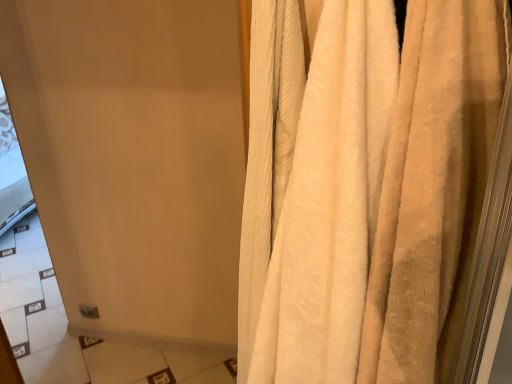
What do you see at coordinates (432, 191) in the screenshot? The image size is (512, 384). I see `beige textured curtain at right` at bounding box center [432, 191].

This screenshot has height=384, width=512. I want to click on beige textured curtain at right, so click(432, 191).

I want to click on matte white screen door at upper left, so click(x=134, y=157).

This screenshot has height=384, width=512. What do you see at coordinates (134, 157) in the screenshot? I see `matte white screen door at upper left` at bounding box center [134, 157].

Locate an element on the screen. The height and width of the screenshot is (384, 512). beige textured curtain at right is located at coordinates (432, 191).

Is matte white screen door at upper left to the left of beige textured curtain at right from the viewer's perspective?

Yes.

Considering the positions of objects matte white screen door at upper left and beige textured curtain at right in the image provided, who is in front, matte white screen door at upper left or beige textured curtain at right?

Positioned in front is beige textured curtain at right.

Is point (231, 298) positioned in front of point (384, 242)?

No, it is behind (384, 242).

From the image's perspective, does matte white screen door at upper left appear higher than beige textured curtain at right?

No, from the image's perspective, matte white screen door at upper left is not on top of beige textured curtain at right.

From a real-world perspective, between matte white screen door at upper left and beige textured curtain at right, who is vertically higher?

beige textured curtain at right.

Which object is wider, matte white screen door at upper left or beige textured curtain at right?

With larger width is beige textured curtain at right.

Who is taller, matte white screen door at upper left or beige textured curtain at right?

Standing taller between the two is matte white screen door at upper left.

Considering the relative sizes of matte white screen door at upper left and beige textured curtain at right in the image provided, is matte white screen door at upper left smaller than beige textured curtain at right?

Incorrect, matte white screen door at upper left is not smaller in size than beige textured curtain at right.

Choose the correct answer: Is matte white screen door at upper left inside beige textured curtain at right or outside it?

matte white screen door at upper left exists outside the volume of beige textured curtain at right.

Is matte white screen door at upper left next to beige textured curtain at right and touching it?

No.

Is beige textured curtain at right at the back of matte white screen door at upper left?

No.

How different are the orientations of matte white screen door at upper left and beige textured curtain at right in degrees?

The facing directions of matte white screen door at upper left and beige textured curtain at right are 4.56 degrees apart.

Identify the location of screen door that appears below the beige textured curtain at right (from the image's perspective). This screenshot has width=512, height=384. (134, 157).

Is beige textured curtain at right to the right of matte white screen door at upper left from the viewer's perspective?

Correct, you'll find beige textured curtain at right to the right of matte white screen door at upper left.

Considering the relative positions of beige textured curtain at right and matte white screen door at upper left in the image provided, is beige textured curtain at right behind matte white screen door at upper left?

No, it is in front of matte white screen door at upper left.

Is point (390, 330) farther from viewer compared to point (58, 12)?

No, (390, 330) is closer to viewer.

From the image's perspective, which one is positioned higher, beige textured curtain at right or matte white screen door at upper left?

beige textured curtain at right, from the image's perspective.

From a real-world perspective, which is physically below, beige textured curtain at right or matte white screen door at upper left?

From a 3D spatial view, matte white screen door at upper left is below.

Considering the sizes of objects beige textured curtain at right and matte white screen door at upper left in the image provided, who is wider, beige textured curtain at right or matte white screen door at upper left?

With larger width is beige textured curtain at right.

Does beige textured curtain at right have a greater height compared to matte white screen door at upper left?

Incorrect, the height of beige textured curtain at right is not larger of that of matte white screen door at upper left.

In terms of size, does beige textured curtain at right appear bigger or smaller than matte white screen door at upper left?

Clearly, beige textured curtain at right is smaller in size than matte white screen door at upper left.

Choose the correct answer: Is beige textured curtain at right inside matte white screen door at upper left or outside it?

beige textured curtain at right is outside matte white screen door at upper left.

Does beige textured curtain at right touch matte white screen door at upper left?

No, beige textured curtain at right is not next to matte white screen door at upper left.

Consider the image. Is beige textured curtain at right positioned with its back to matte white screen door at upper left?

That's not correct — beige textured curtain at right is not looking away from matte white screen door at upper left.

Can you tell me how much beige textured curtain at right and matte white screen door at upper left differ in facing direction?

The angle between the facing direction of beige textured curtain at right and the facing direction of matte white screen door at upper left is 4.56 degrees.

Measure the distance from beige textured curtain at right to matte white screen door at upper left.

beige textured curtain at right is 4.06 feet from matte white screen door at upper left.

This screenshot has height=384, width=512. I want to click on screen door below the beige textured curtain at right (from the image's perspective), so click(x=134, y=157).

Identify the location of screen door that appears behind the beige textured curtain at right. This screenshot has width=512, height=384. (134, 157).

Image resolution: width=512 pixels, height=384 pixels. In order to click on screen door located below the beige textured curtain at right (from the image's perspective) in this screenshot , I will do `click(134, 157)`.